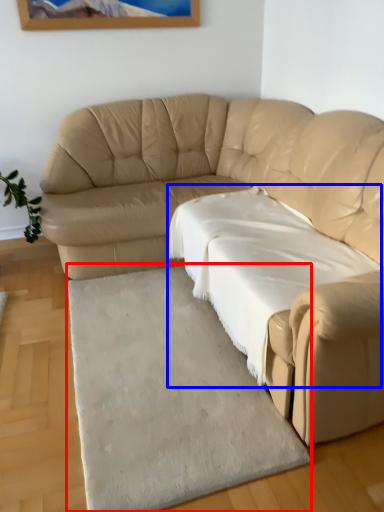
Question: Which object is closer to the camera taking this photo, mat (highlighted by a red box) or sheet (highlighted by a blue box)?

Choices:
 (A) mat
 (B) sheet

Answer: (A)